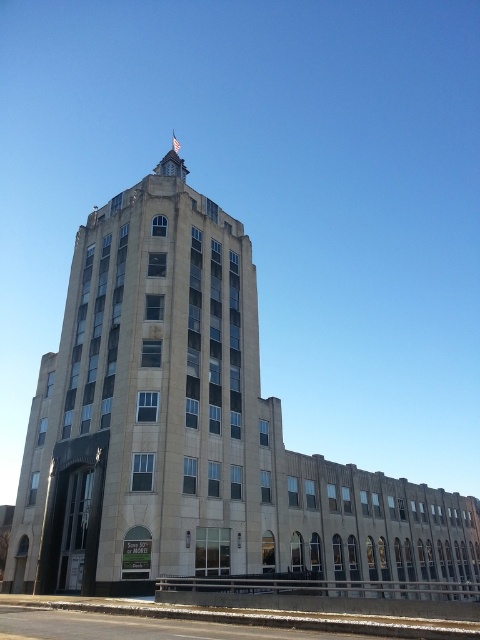
Question: Is beige stone tower at center wider than stained glass clock at upper center?

Choices:
 (A) no
 (B) yes

Answer: (B)

Question: Is beige stone tower at center wider than stained glass clock at upper center?

Choices:
 (A) yes
 (B) no

Answer: (A)

Question: Which of the following is the farthest from the observer?

Choices:
 (A) beige stone tower at center
 (B) stained glass clock at upper center

Answer: (B)

Question: Which object is closer to the camera taking this photo?

Choices:
 (A) stained glass clock at upper center
 (B) beige stone tower at center

Answer: (B)

Question: Is beige stone tower at center to the right of stained glass clock at upper center from the viewer's perspective?

Choices:
 (A) yes
 (B) no

Answer: (B)

Question: Among these objects, which one is farthest from the camera?

Choices:
 (A) stained glass clock at upper center
 (B) beige stone tower at center

Answer: (A)